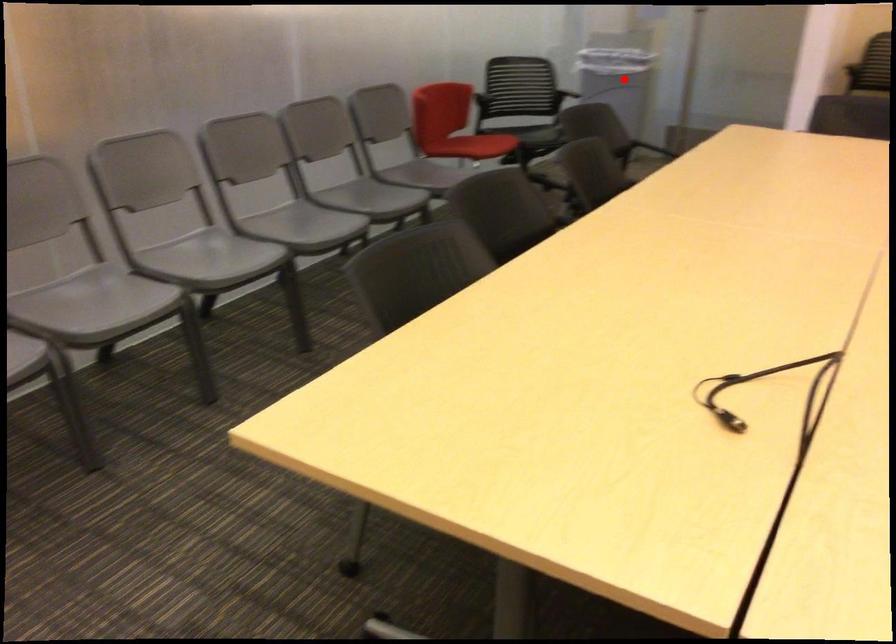
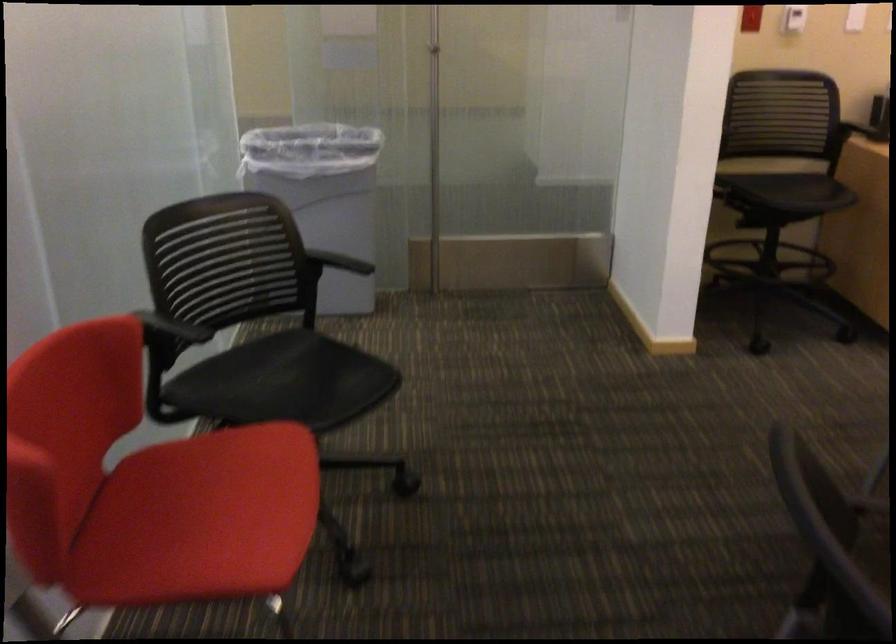
Find the pixel in the second image that matches the highlighted location in the first image.

(323, 196)